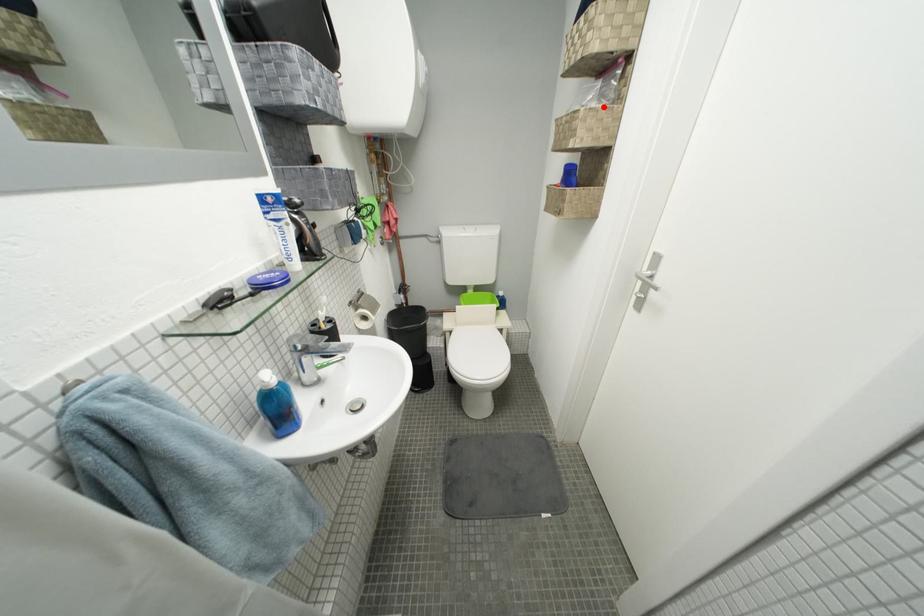
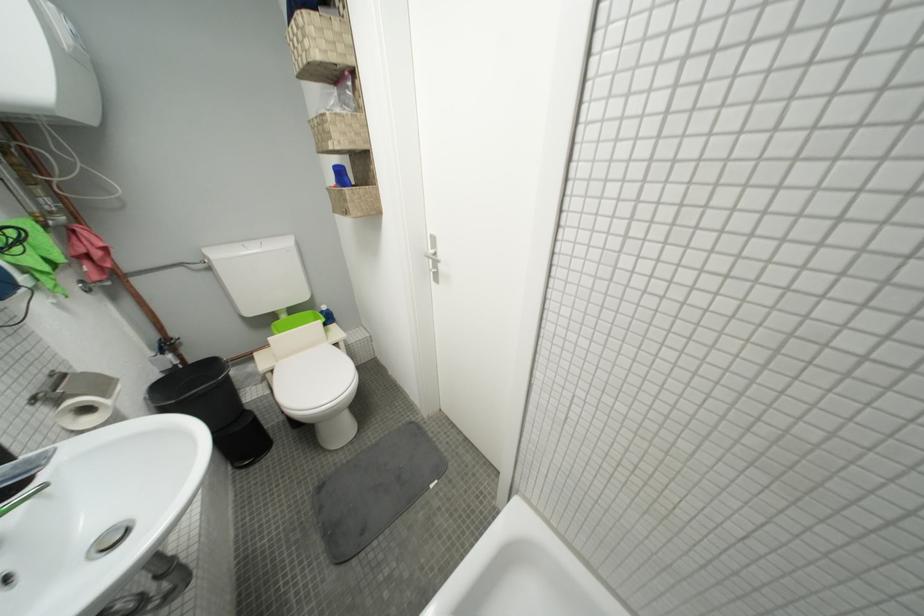
Locate, in the second image, the point that corresponds to the highlighted location in the first image.

(346, 113)